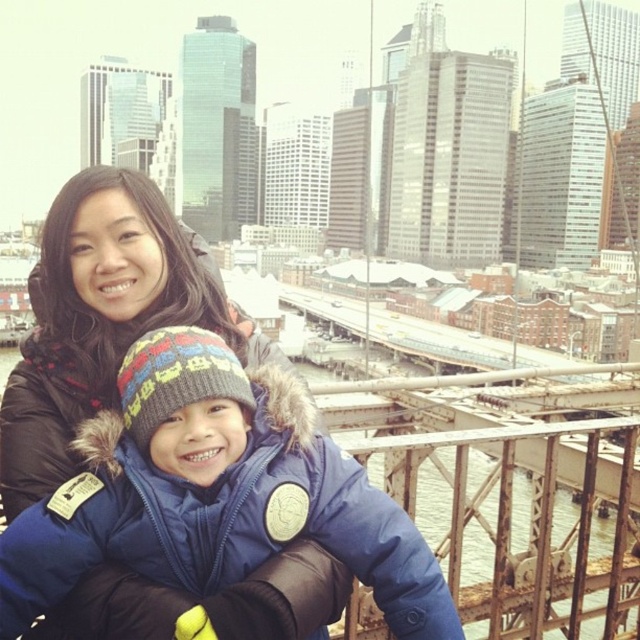
Question: Which object is farther from the camera taking this photo?

Choices:
 (A) blue down jacket at center
 (B) matte black coat at center

Answer: (B)

Question: Considering the relative positions of blue down jacket at center and matte black coat at center in the image provided, where is blue down jacket at center located with respect to matte black coat at center?

Choices:
 (A) above
 (B) below

Answer: (B)

Question: Is blue down jacket at center above matte black coat at center?

Choices:
 (A) no
 (B) yes

Answer: (A)

Question: From the image, what is the correct spatial relationship of blue down jacket at center in relation to matte black coat at center?

Choices:
 (A) above
 (B) below

Answer: (B)

Question: Which of the following is the closest to the observer?

Choices:
 (A) (10, 461)
 (B) (189, 580)

Answer: (B)